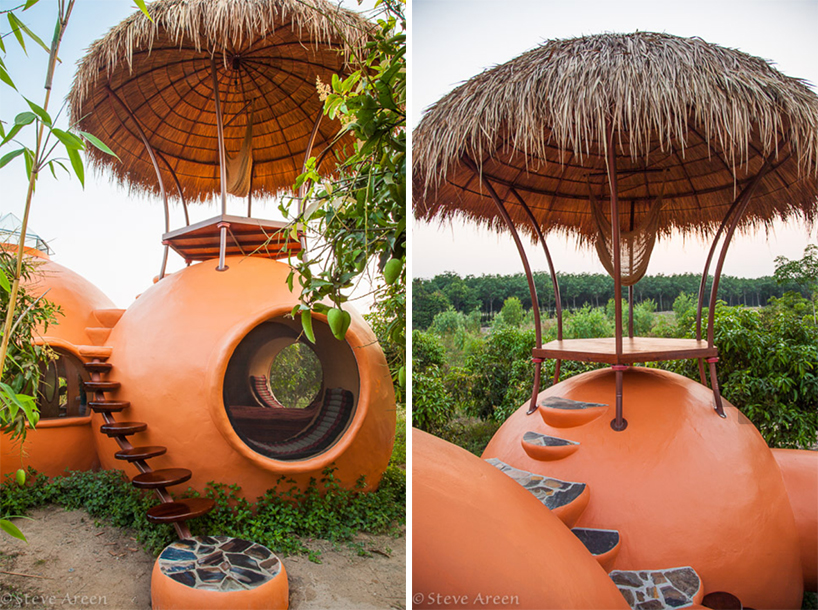
At what (x,y) coordinates should I click in order to perform the action: click on thin plant on the left side. Please return your answer as a coordinate pair (x, y). This screenshot has width=818, height=610. Looking at the image, I should click on click(x=12, y=321).